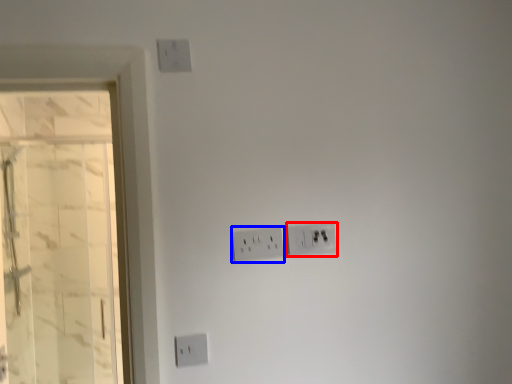
Question: Which object is further to the camera taking this photo, power plugs and sockets (highlighted by a red box) or power plugs and sockets (highlighted by a blue box)?

Choices:
 (A) power plugs and sockets
 (B) power plugs and sockets

Answer: (A)